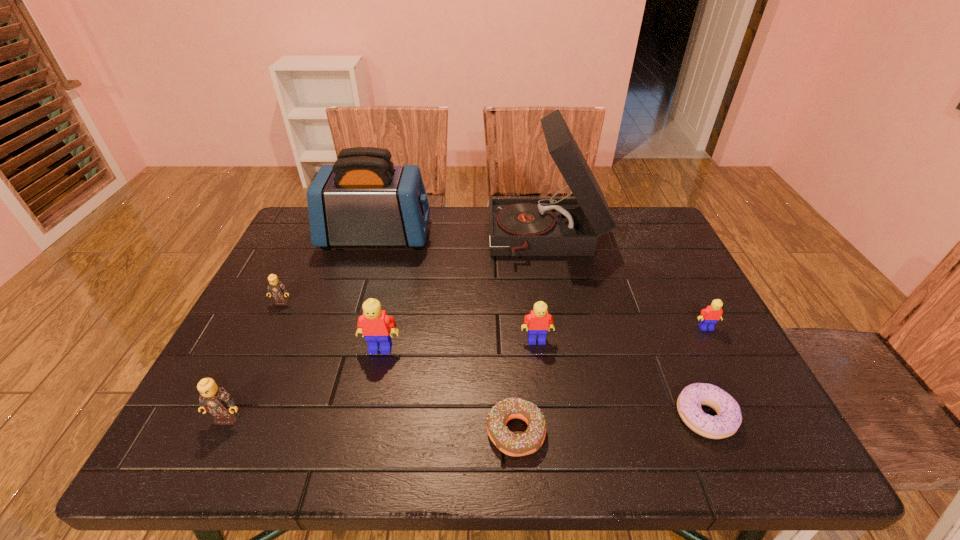
This screenshot has width=960, height=540. What are the coordinates of `the smallest yellow Lego` in the screenshot? It's located at (709, 316).

The height and width of the screenshot is (540, 960). What are the coordinates of `the farthest Lego` in the screenshot? It's located at (276, 289).

The image size is (960, 540). I want to click on the smaller tan Lego, so click(x=276, y=289).

The image size is (960, 540). I want to click on the second object from right to left, so click(x=727, y=421).

You are a GUI agent. You are given a task and a screenshot of the screen. Output one action in this format:
    pyautogui.click(x=<x>, y=<y>)
    Task: Click on the right doughnut
    
    Given the screenshot: What is the action you would take?
    pyautogui.click(x=727, y=421)

What are the coordinates of `chocolate doughnut` in the screenshot? It's located at (512, 444).

Locate an element on the screen. The width and height of the screenshot is (960, 540). blank area located on the front-facing side of the phonograph_record is located at coordinates (405, 240).

The width and height of the screenshot is (960, 540). I want to click on vacant space situated on the front-facing side of the phonograph_record, so click(x=459, y=240).

The height and width of the screenshot is (540, 960). Find the location of `vacant region located 0.260m on the front-facing side of the phonograph_record`. vacant region located 0.260m on the front-facing side of the phonograph_record is located at coordinates (402, 240).

I want to click on vacant space located 0.280m on the front-facing side of the blue toaster, so click(x=522, y=237).